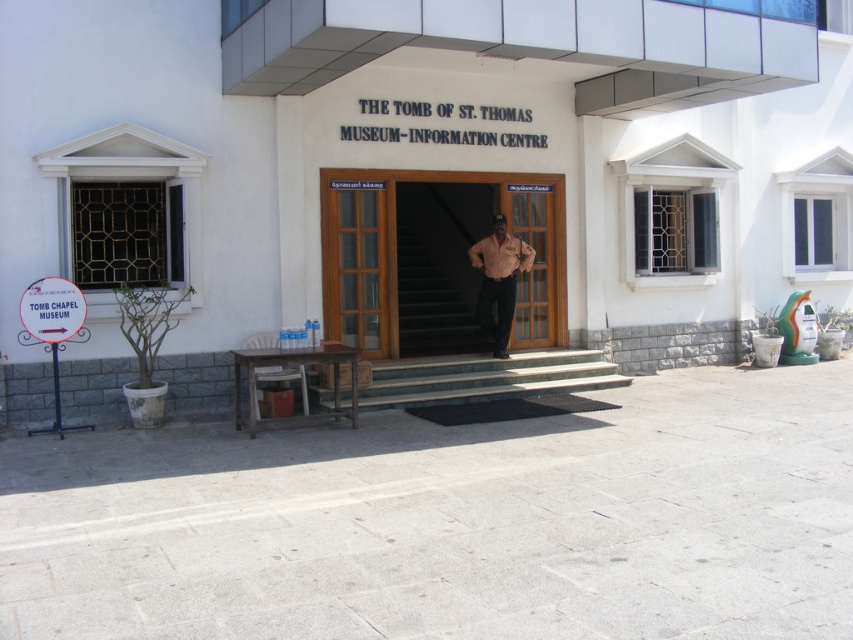
Question: Which point appears closest to the camera in this image?

Choices:
 (A) (514, 224)
 (B) (515, 244)

Answer: (B)

Question: Observing the image, what is the correct spatial positioning of brown wooden door at center in reference to matte beige shirt at center?

Choices:
 (A) left
 (B) right

Answer: (A)

Question: Is brown wooden door at center wider than matte beige shirt at center?

Choices:
 (A) yes
 (B) no

Answer: (A)

Question: Where is brown wooden door at center located in relation to matte beige shirt at center in the image?

Choices:
 (A) below
 (B) above

Answer: (B)